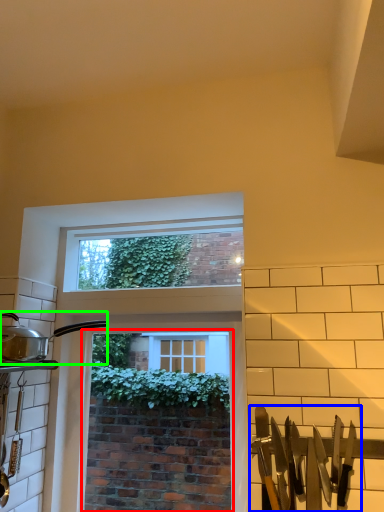
Question: Based on their relative distances, which object is nearer to window screen (highlighted by a red box)? Choose from silverware (highlighted by a blue box) and kitchen appliance (highlighted by a green box).

Choices:
 (A) silverware
 (B) kitchen appliance

Answer: (B)